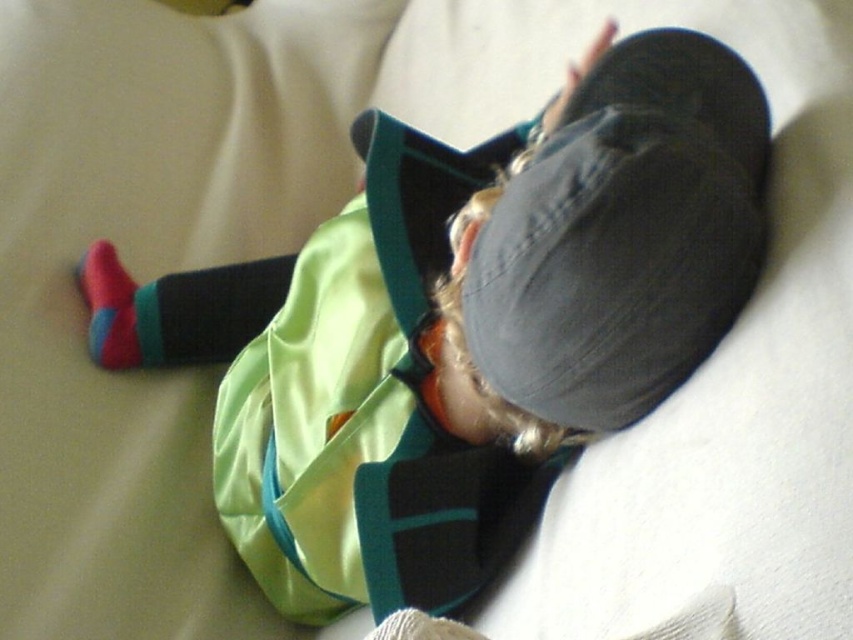
Question: Which object appears closest to the camera in this image?

Choices:
 (A) green fabric safety vest at center
 (B) red cotton sock at lower left

Answer: (A)

Question: Is green fabric safety vest at center positioned at the back of red cotton sock at lower left?

Choices:
 (A) yes
 (B) no

Answer: (B)

Question: Is green fabric safety vest at center closer to the viewer compared to red cotton sock at lower left?

Choices:
 (A) yes
 (B) no

Answer: (A)

Question: Does green fabric safety vest at center have a smaller size compared to red cotton sock at lower left?

Choices:
 (A) yes
 (B) no

Answer: (B)